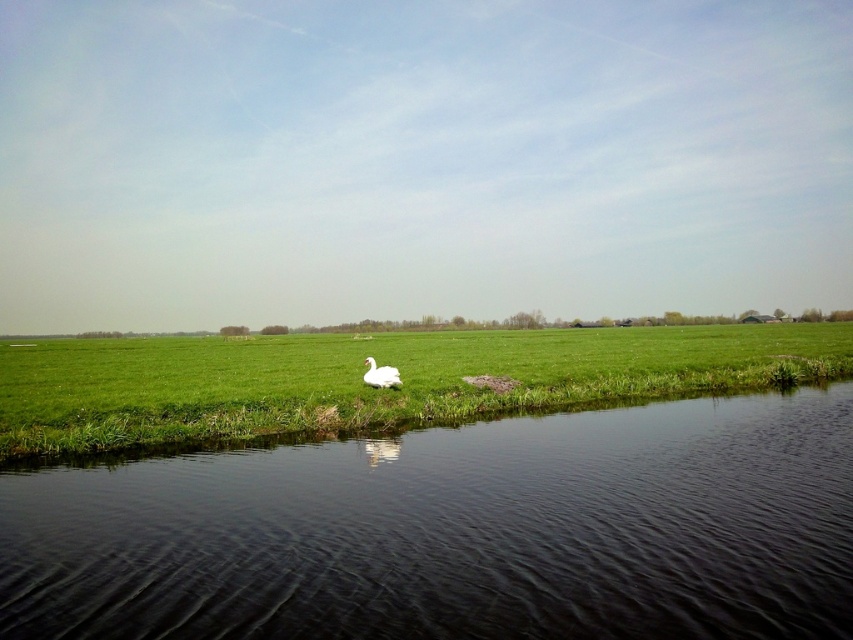
Question: Does black water at lower center have a lesser width compared to white glossy swan at center?

Choices:
 (A) no
 (B) yes

Answer: (A)

Question: Estimate the real-world distances between objects in this image. Which object is closer to the white glossy swan at center?

Choices:
 (A) black water at lower center
 (B) green grassy at center

Answer: (A)

Question: Which of the following is the farthest from the observer?

Choices:
 (A) (405, 618)
 (B) (669, 388)
 (C) (375, 365)

Answer: (B)

Question: Can you confirm if green grassy at center is positioned above white glossy swan at center?

Choices:
 (A) no
 (B) yes

Answer: (B)

Question: Which object is closer to the camera taking this photo?

Choices:
 (A) white glossy swan at center
 (B) black water at lower center
 (C) green grassy at center

Answer: (B)

Question: Can you confirm if black water at lower center is positioned to the left of green grassy at center?

Choices:
 (A) yes
 (B) no

Answer: (B)